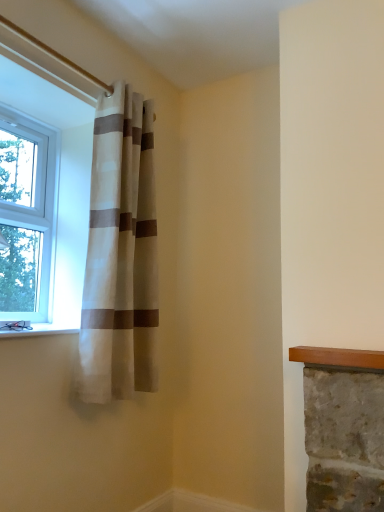
Question: Is white stone window sill at lower left further to camera compared to clear glass window at left?

Choices:
 (A) yes
 (B) no

Answer: (B)

Question: Is white stone window sill at lower left not within clear glass window at left?

Choices:
 (A) yes
 (B) no

Answer: (A)

Question: Are white stone window sill at lower left and clear glass window at left making contact?

Choices:
 (A) no
 (B) yes

Answer: (A)

Question: Is white stone window sill at lower left positioned with its back to clear glass window at left?

Choices:
 (A) no
 (B) yes

Answer: (A)

Question: Is clear glass window at left surrounded by white stone window sill at lower left?

Choices:
 (A) no
 (B) yes

Answer: (A)

Question: From the image's perspective, does white stone window sill at lower left appear lower than clear glass window at left?

Choices:
 (A) yes
 (B) no

Answer: (A)

Question: Considering the relative sizes of clear glass window at left and beige/white striped curtain at upper left in the image provided, is clear glass window at left shorter than beige/white striped curtain at upper left?

Choices:
 (A) yes
 (B) no

Answer: (A)

Question: Considering the relative sizes of clear glass window at left and beige/white striped curtain at upper left in the image provided, is clear glass window at left wider than beige/white striped curtain at upper left?

Choices:
 (A) yes
 (B) no

Answer: (B)

Question: Is clear glass window at left surrounding beige/white striped curtain at upper left?

Choices:
 (A) yes
 (B) no

Answer: (B)

Question: From the image's perspective, is clear glass window at left below beige/white striped curtain at upper left?

Choices:
 (A) yes
 (B) no

Answer: (B)

Question: Considering the relative sizes of clear glass window at left and beige/white striped curtain at upper left in the image provided, is clear glass window at left thinner than beige/white striped curtain at upper left?

Choices:
 (A) yes
 (B) no

Answer: (A)

Question: Can you confirm if clear glass window at left is positioned to the left of beige/white striped curtain at upper left?

Choices:
 (A) yes
 (B) no

Answer: (A)

Question: Is beige/white striped curtain at upper left beside clear glass window at left?

Choices:
 (A) yes
 (B) no

Answer: (B)